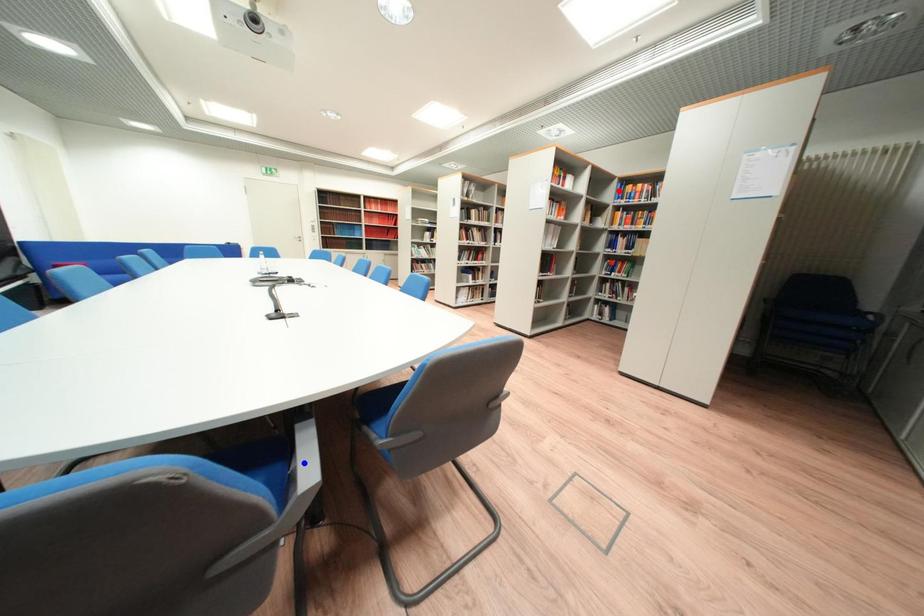
Question: Two points are marked on the image. Which point is closer to the camera?

Choices:
 (A) Blue point is closer.
 (B) Red point is closer.

Answer: (A)